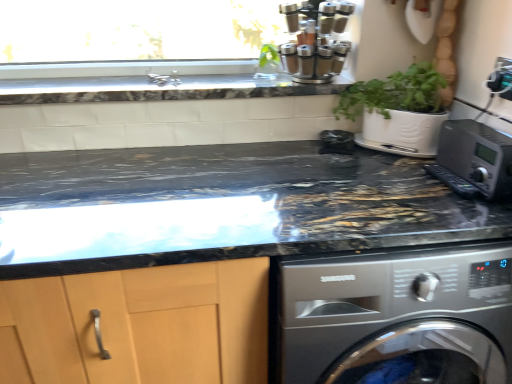
Question: In the image, is satin silver spice rack at upper center positioned in front of or behind metallic silver microwave at right?

Choices:
 (A) behind
 (B) front

Answer: (A)

Question: Considering the positions of satin silver spice rack at upper center and metallic silver microwave at right in the image, is satin silver spice rack at upper center wider or thinner than metallic silver microwave at right?

Choices:
 (A) thin
 (B) wide

Answer: (B)

Question: Estimate the real-world distances between objects in this image. Which object is farther from the green leafy plant at upper center?

Choices:
 (A) satin silver spice rack at upper center
 (B) metallic silver microwave at right
 (C) black marble countertop at upper center, which is the first countertop from top to bottom
 (D) marble at center, which is the 2th countertop in top-to-bottom order

Answer: (B)

Question: Based on their relative distances, which object is nearer to the black marble countertop at upper center, which is the first countertop from top to bottom?

Choices:
 (A) marble at center, which is the 2th countertop in top-to-bottom order
 (B) green leafy plant at upper center
 (C) metallic silver microwave at right
 (D) satin silver spice rack at upper center

Answer: (D)